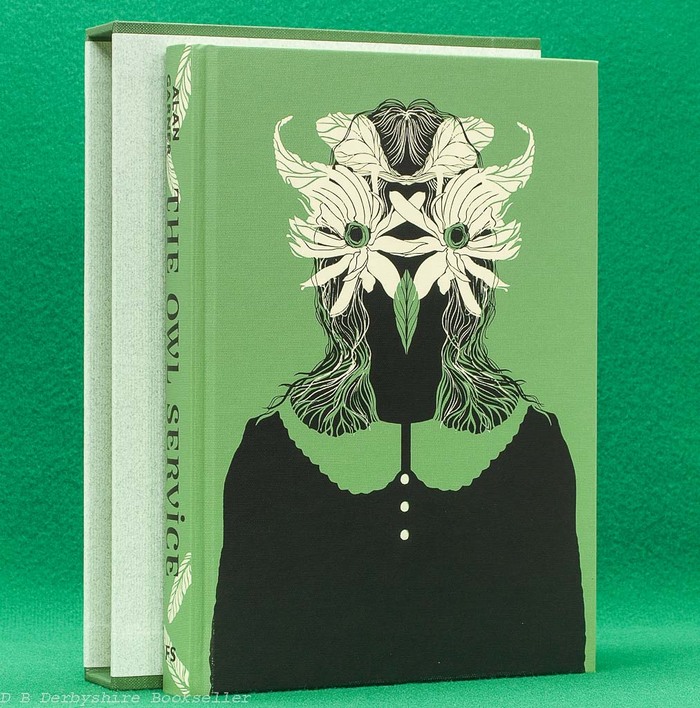
I want to click on green book cover, so click(306, 323).